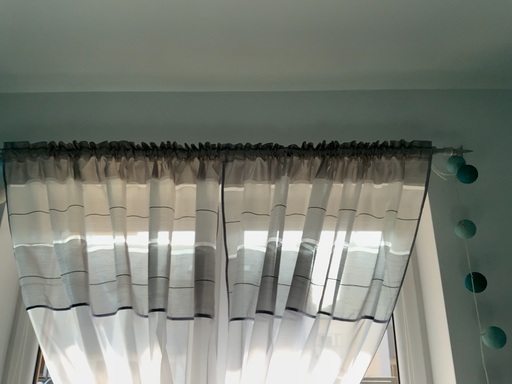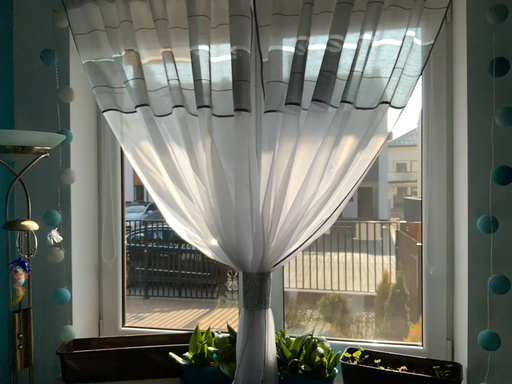
Question: How did the camera likely rotate when shooting the video?

Choices:
 (A) rotated right
 (B) rotated left

Answer: (B)